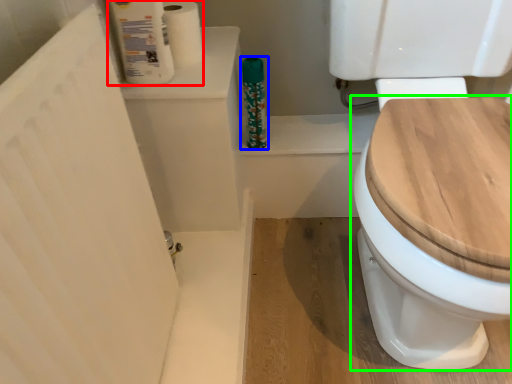
Question: Which object is the farthest from toilet paper (highlighted by a red box)? Choose among these: cleaning product (highlighted by a blue box) or toilet (highlighted by a green box).

Choices:
 (A) cleaning product
 (B) toilet

Answer: (B)